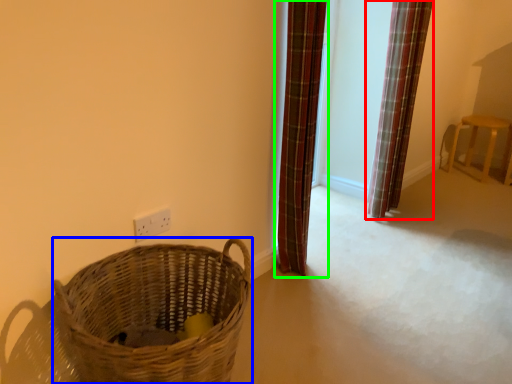
Question: Based on their relative distances, which object is nearer to curtain (highlighted by a red box)? Choose from basket (highlighted by a blue box) and curtain (highlighted by a green box).

Choices:
 (A) basket
 (B) curtain

Answer: (B)